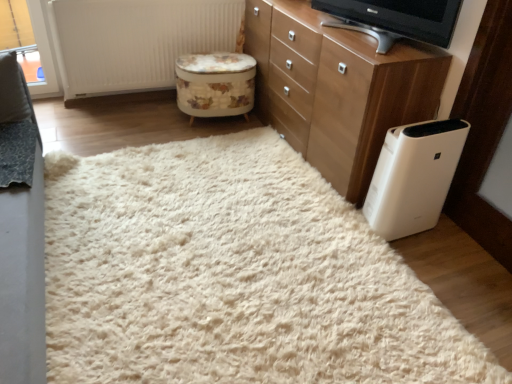
Where is `vacant space in front of floral fabric ottoman at center`? vacant space in front of floral fabric ottoman at center is located at coordinates (198, 136).